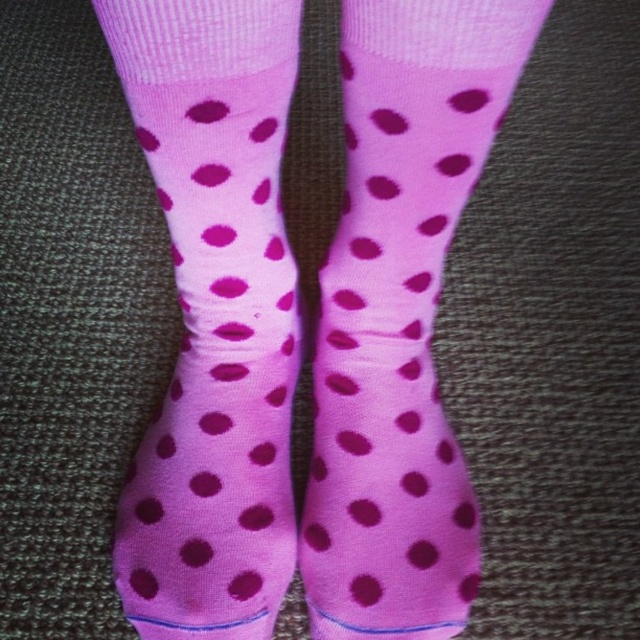
Is point (264, 541) positioned in front of point (392, 628)?

No, (264, 541) is further to viewer.

Locate an element on the screen. The width and height of the screenshot is (640, 640). pink dotted sock at center is located at coordinates (212, 316).